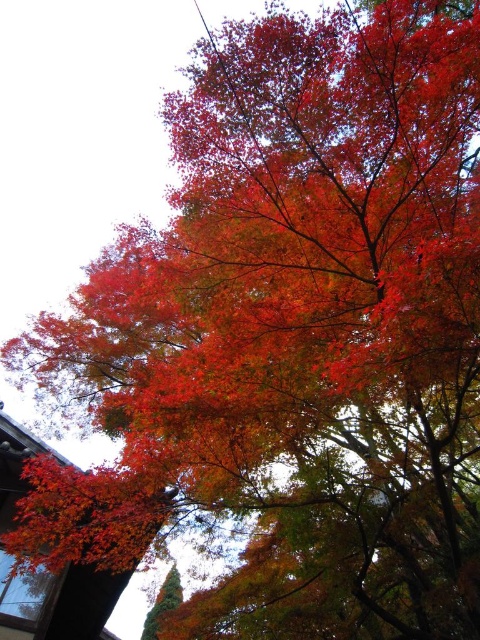
You are standing in the autumn scene and want to pick up the shiny red maple leaf at lower left and the shiny green pine tree at lower left. Which object is easier to reach without moving your position?

The shiny red maple leaf at lower left is closer to the viewer than the shiny green pine tree at lower left, so it is easier to reach without moving your position.

You are standing in the autumn scene and want to pick up the shiny red maple leaf at lower left. Based on its 2D location coordinates, can you estimate where exactly the leaf is located relative to the large tree and the building?

The shiny red maple leaf at lower left is located at coordinates approximately 81.009 percent along the horizontal axis and 17.7 percent along the vertical axis. Since the large tree occupies the central upper area and the building is at the lower left corner, the leaf is positioned near the lower left corner close to the building but still within the foreground of the scene.

You are standing in an autumn scene with a large tree and a traditional building. You notice the shiny red maple leaf at lower left and the shiny green pine tree at lower left. Which object is closer to you? Please answer based on their positions.

The shiny red maple leaf at lower left is positioned over the shiny green pine tree at lower left, indicating it is closer to the viewer.